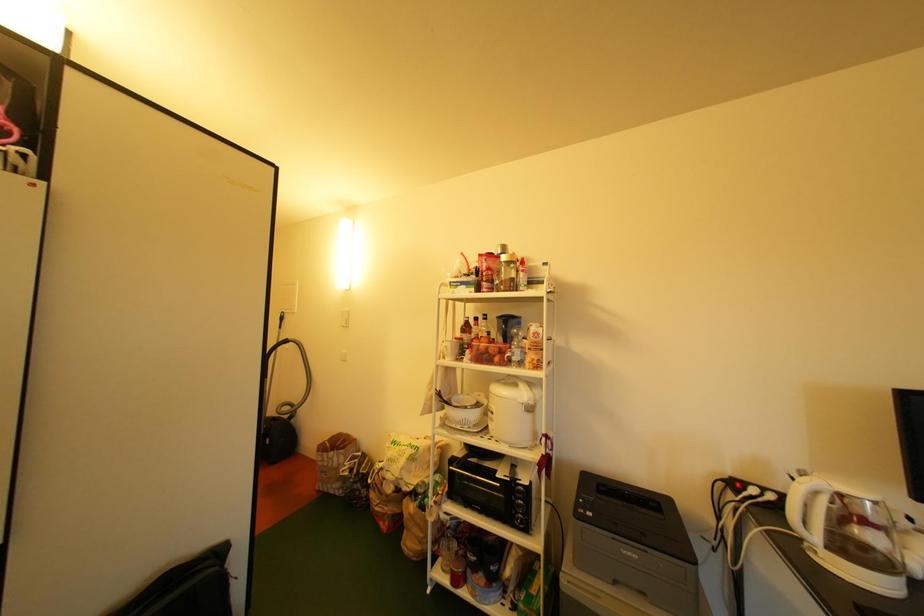
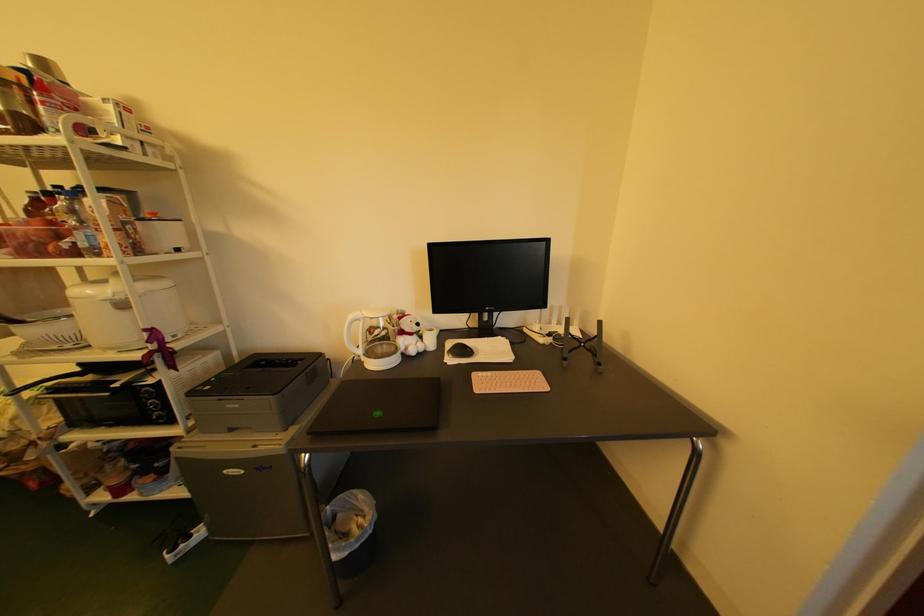
How did the camera likely rotate?

The camera rotated toward right-down.